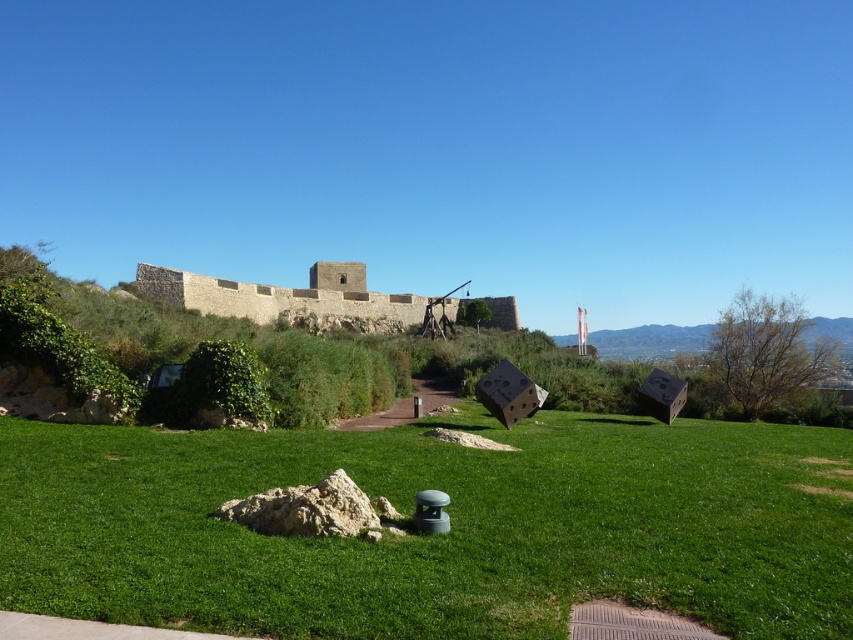
Between point (722, 445) and point (354, 264), which one is positioned in front?

Positioned in front is point (722, 445).

Between green grass at center and stone wall at center, which one appears on the right side from the viewer's perspective?

green grass at center is more to the right.

Measure the distance between point (x=724, y=516) and camera.

The distance of point (x=724, y=516) from camera is 45.00 meters.

I want to click on green grass at center, so click(434, 536).